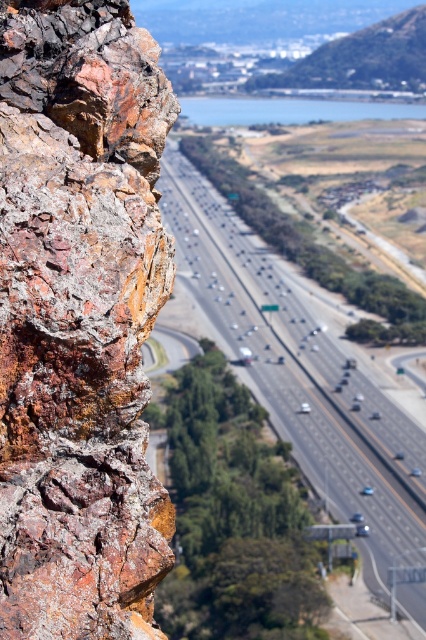
Is rusty rock at left positioned before smooth asphalt highway at center?

Yes.

Who is positioned more to the left, rusty rock at left or smooth asphalt highway at center?

From the viewer's perspective, rusty rock at left appears more on the left side.

Where is `rusty rock at left`? rusty rock at left is located at coordinates (80, 320).

Between rusty rock at left and green grassy hill at upper right, which one appears on the right side from the viewer's perspective?

Positioned to the right is green grassy hill at upper right.

Measure the distance from rusty rock at left to green grassy hill at upper right.

rusty rock at left is 664.77 meters from green grassy hill at upper right.

Is point (23, 364) positioned before point (400, 20)?

Yes, it is.

The width and height of the screenshot is (426, 640). Identify the location of rusty rock at left. (80, 320).

Which is in front, point (250, 280) or point (385, 51)?

Point (250, 280) is in front.

Can you confirm if smooth asphalt highway at center is bigger than green grassy hill at upper right?

Correct, smooth asphalt highway at center is larger in size than green grassy hill at upper right.

Between point (267, 280) and point (417, 10), which one is positioned behind?

Point (417, 10)

Identify the location of smooth asphalt highway at center. This screenshot has width=426, height=640. (302, 369).